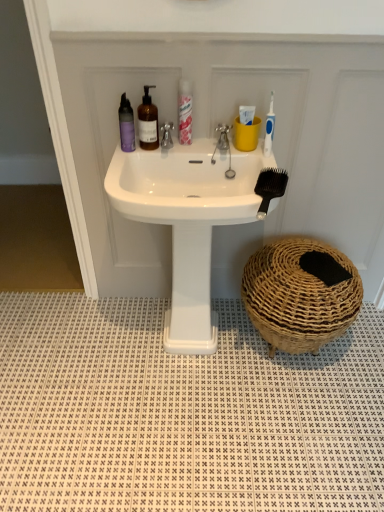
Where is `vacant space in brown woven basket at lower right (from a real-world perspective)`? The height and width of the screenshot is (512, 384). vacant space in brown woven basket at lower right (from a real-world perspective) is located at coordinates (289, 358).